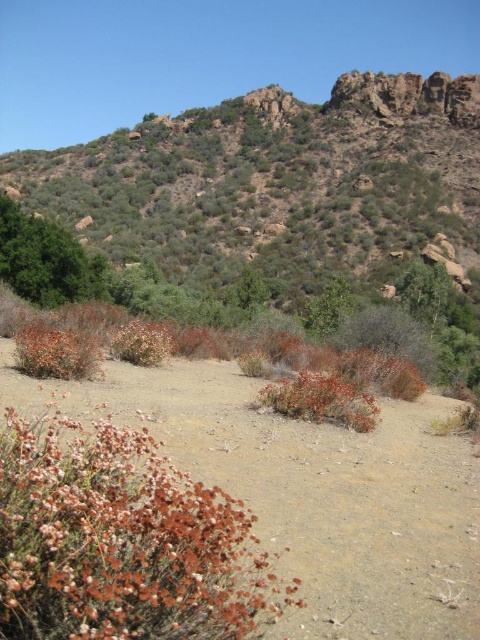
Can you confirm if dried brown flowers at lower left is positioned to the right of dried grass at center?

Incorrect, dried brown flowers at lower left is not on the right side of dried grass at center.

Is dried brown flowers at lower left thinner than dried grass at center?

Incorrect, dried brown flowers at lower left's width is not less than dried grass at center's.

Which is behind, point (169, 480) or point (292, 412)?

The point (292, 412) is more distant.

The width and height of the screenshot is (480, 640). I want to click on dried brown flowers at lower left, so click(x=121, y=540).